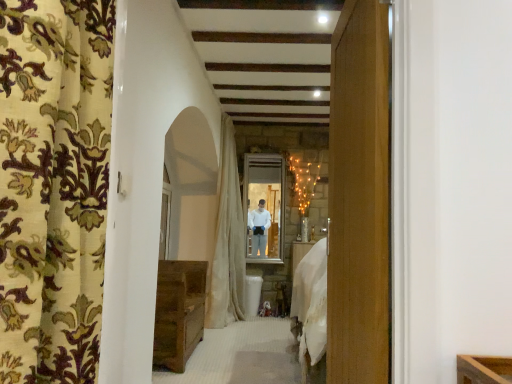
Question: Is white textured curtain at center, which is counted as the second curtain, starting from the front, oriented towards clear glass window at center, which appears as the second window when viewed from the back?

Choices:
 (A) no
 (B) yes

Answer: (A)

Question: Considering the relative sizes of white textured curtain at center, placed as the 1th curtain when sorted from back to front, and clear glass window at center, which appears as the second window when viewed from the back, in the image provided, is white textured curtain at center, placed as the 1th curtain when sorted from back to front, smaller than clear glass window at center, which appears as the second window when viewed from the back,?

Choices:
 (A) no
 (B) yes

Answer: (A)

Question: Considering the relative sizes of white textured curtain at center, which is counted as the second curtain, starting from the front, and clear glass window at center, marked as the 1th window in a front-to-back arrangement, in the image provided, is white textured curtain at center, which is counted as the second curtain, starting from the front, thinner than clear glass window at center, marked as the 1th window in a front-to-back arrangement,?

Choices:
 (A) yes
 (B) no

Answer: (B)

Question: From a real-world perspective, is white textured curtain at center, which is counted as the second curtain, starting from the front, on clear glass window at center, the first window from the left?

Choices:
 (A) no
 (B) yes

Answer: (B)

Question: Can you confirm if white textured curtain at center, placed as the 1th curtain when sorted from back to front, is bigger than clear glass window at center, positioned as the 2th window in right-to-left order?

Choices:
 (A) yes
 (B) no

Answer: (A)

Question: From the image's perspective, is white textured curtain at center, placed as the 1th curtain when sorted from back to front, over clear glass window at center, positioned as the 2th window in right-to-left order?

Choices:
 (A) yes
 (B) no

Answer: (A)

Question: Is rustic wood chest at lower left smaller than white textured curtain at center, which is counted as the second curtain, starting from the front?

Choices:
 (A) no
 (B) yes

Answer: (B)

Question: From a real-world perspective, is rustic wood chest at lower left on top of white textured curtain at center, placed as the 1th curtain when sorted from back to front?

Choices:
 (A) yes
 (B) no

Answer: (B)

Question: Is rustic wood chest at lower left facing away from white textured curtain at center, which is counted as the second curtain, starting from the front?

Choices:
 (A) no
 (B) yes

Answer: (A)

Question: Is rustic wood chest at lower left bigger than white textured curtain at center, which is counted as the second curtain, starting from the front?

Choices:
 (A) no
 (B) yes

Answer: (A)

Question: Could you tell me if rustic wood chest at lower left is turned towards white textured curtain at center, placed as the 1th curtain when sorted from back to front?

Choices:
 (A) no
 (B) yes

Answer: (A)

Question: From the image's perspective, is rustic wood chest at lower left under white textured curtain at center, which is counted as the second curtain, starting from the front?

Choices:
 (A) yes
 (B) no

Answer: (A)

Question: Considering the relative sizes of white textured curtain at center, which is counted as the second curtain, starting from the front, and clear glass window at center, which ranks as the second window in left-to-right order, in the image provided, is white textured curtain at center, which is counted as the second curtain, starting from the front, thinner than clear glass window at center, which ranks as the second window in left-to-right order,?

Choices:
 (A) no
 (B) yes

Answer: (A)